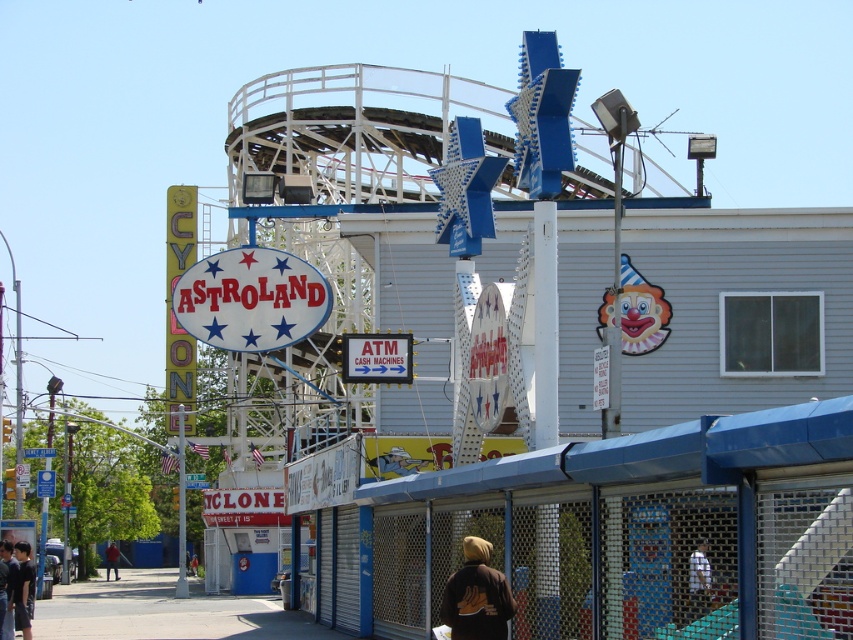
Is dark brown leather jacket at lower left below red shirt at lower left?

No, dark brown leather jacket at lower left is not below red shirt at lower left.

Which is in front, point (21, 545) or point (115, 564)?

Point (21, 545) is more forward.

The height and width of the screenshot is (640, 853). What are the coordinates of `dark brown leather jacket at lower left` in the screenshot? It's located at (22, 588).

Which is above, brown fleece jacket at lower center or dark brown leather jacket at lower left?

brown fleece jacket at lower center is above.

Is brown fleece jacket at lower center thinner than dark brown leather jacket at lower left?

Indeed, brown fleece jacket at lower center has a lesser width compared to dark brown leather jacket at lower left.

This screenshot has height=640, width=853. What do you see at coordinates (476, 595) in the screenshot?
I see `brown fleece jacket at lower center` at bounding box center [476, 595].

Find the location of `brown fleece jacket at lower center`. brown fleece jacket at lower center is located at coordinates (476, 595).

In the scene shown: Can you confirm if brown fleece jacket at lower center is positioned above red shirt at lower left?

Yes, brown fleece jacket at lower center is above red shirt at lower left.

Is brown fleece jacket at lower center to the left of red shirt at lower left from the viewer's perspective?

No, brown fleece jacket at lower center is not to the left of red shirt at lower left.

Locate an element on the screen. brown fleece jacket at lower center is located at coordinates (476, 595).

The image size is (853, 640). Find the location of `brown fleece jacket at lower center`. brown fleece jacket at lower center is located at coordinates (476, 595).